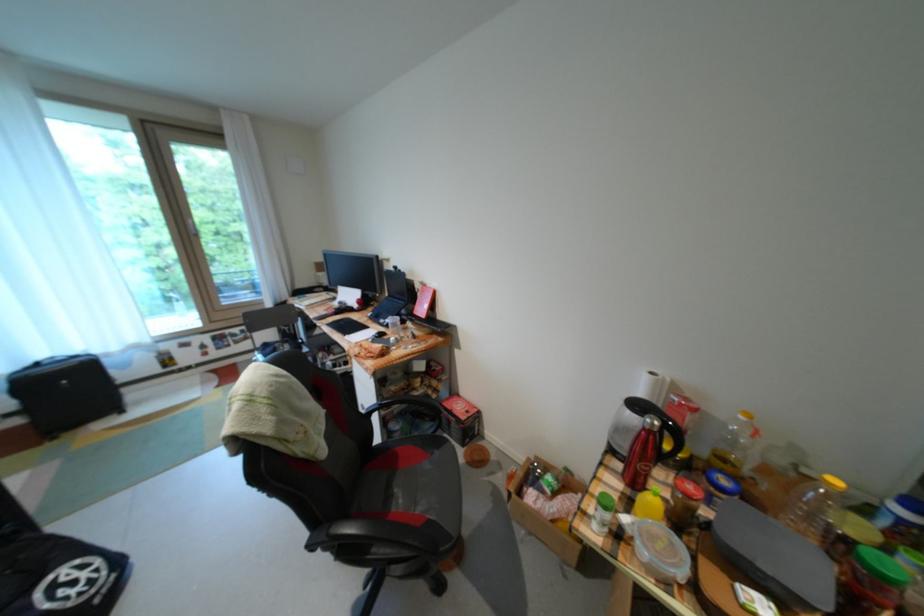
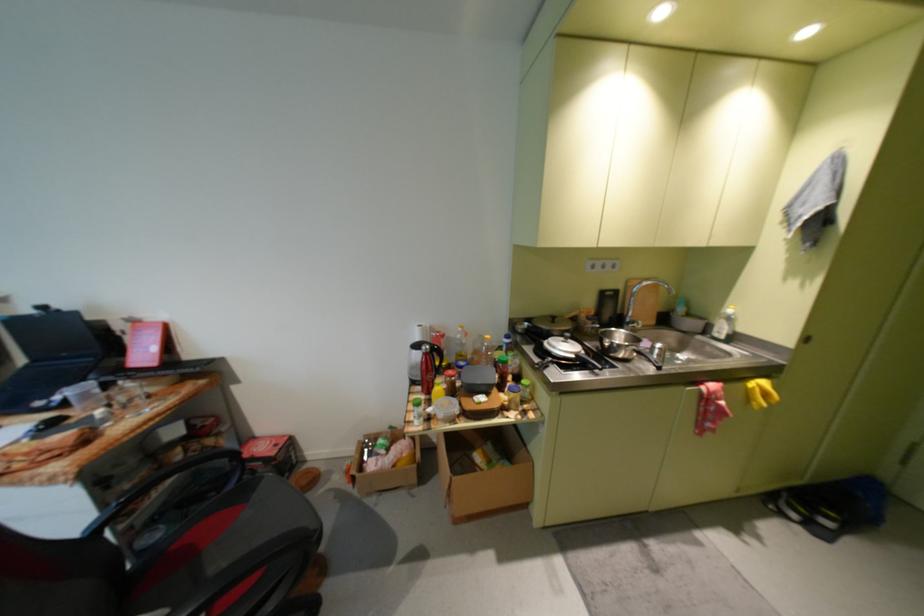
Question: The camera is either moving clockwise (left) or counter-clockwise (right) around the object. The first image is from the beginning of the video and the second image is from the end. Is the camera moving left or right when shooting the video?

Choices:
 (A) Left
 (B) Right

Answer: (A)